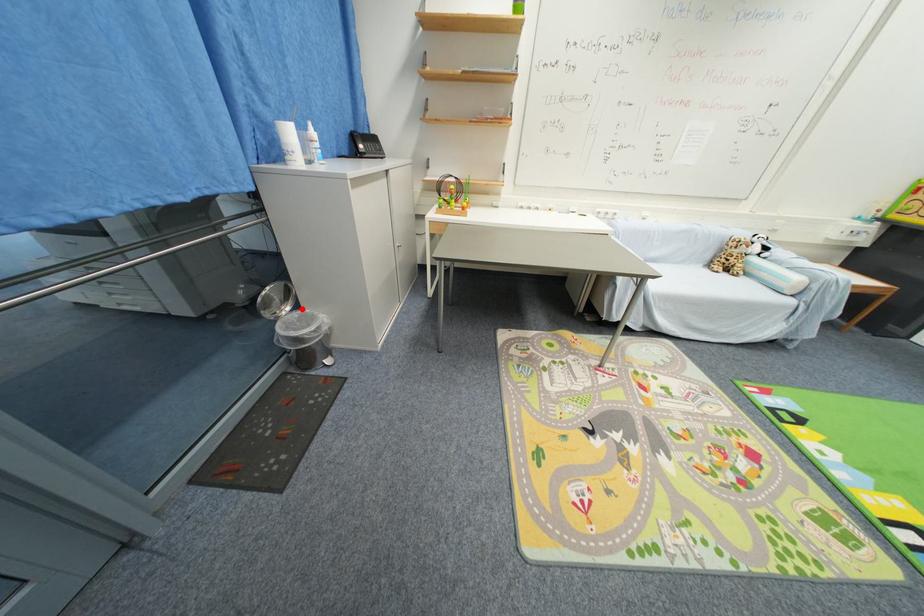
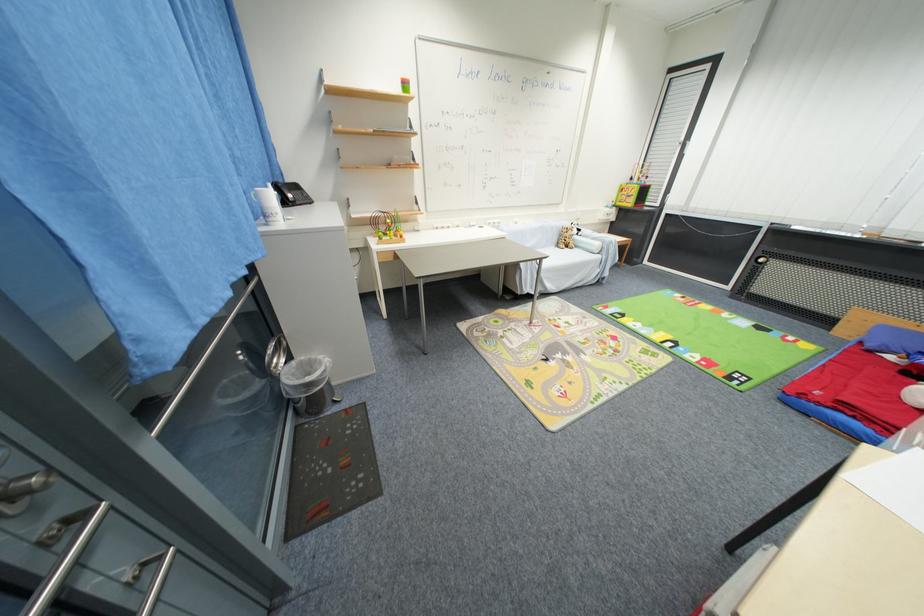
In the second image, find the point that corresponds to the highlighted location in the first image.

(295, 360)